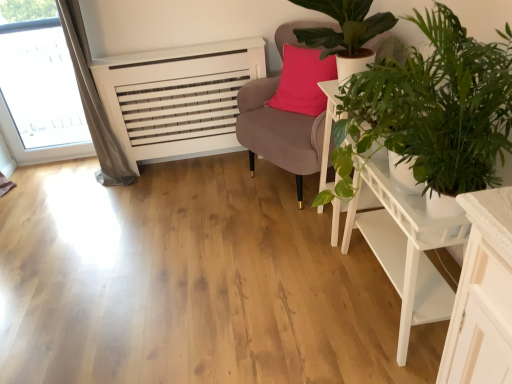
Question: Is white wooden table at lower right spatially inside white wooden side table at center right, or outside of it?

Choices:
 (A) outside
 (B) inside

Answer: (A)

Question: Would you say white wooden table at lower right is to the left or to the right of white wooden side table at center right in the picture?

Choices:
 (A) right
 (B) left

Answer: (A)

Question: Which is nearer to the green leafy plant at upper right, which is counted as the second houseplant, starting from the front?

Choices:
 (A) white wooden table at lower right
 (B) transparent glass window at upper left
 (C) white wooden side table at center right
 (D) green leafy plant at right, positioned as the 1th houseplant in front-to-back order
 (E) velvet pink chair at upper right

Answer: (C)

Question: Based on their relative distances, which object is nearer to the green leafy plant at upper right, which is counted as the second houseplant, starting from the front?

Choices:
 (A) transparent glass window at upper left
 (B) white wooden side table at center right
 (C) velvet pink chair at upper right
 (D) green leafy plant at right, the 2th houseplant viewed from the back
 (E) white wooden table at lower right

Answer: (B)